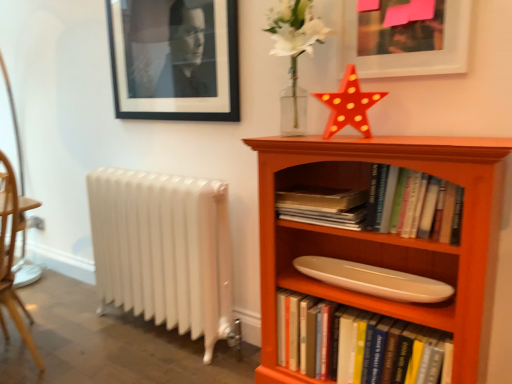
The width and height of the screenshot is (512, 384). What are the coordinates of `unoccupied space behind wooden chair at left` in the screenshot? It's located at (50, 298).